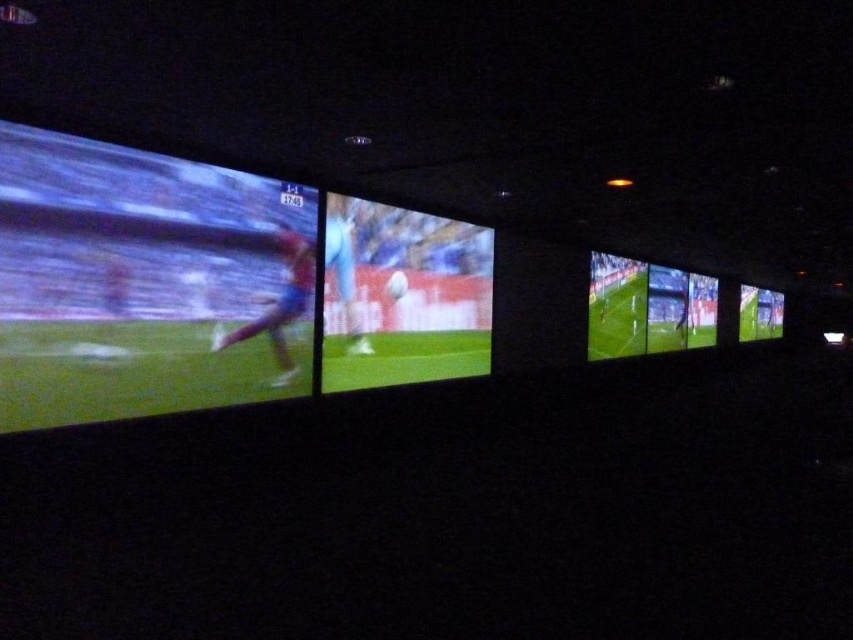
Between matte green screen at center and light blue jersey at center, which one appears on the right side from the viewer's perspective?

From the viewer's perspective, matte green screen at center appears more on the right side.

Does matte green screen at center have a greater height compared to light blue jersey at center?

Indeed, matte green screen at center has a greater height compared to light blue jersey at center.

You are a GUI agent. You are given a task and a screenshot of the screen. Output one action in this format:
    pyautogui.click(x=<x>, y=<y>)
    Task: Click on the matte green screen at center
    This screenshot has height=640, width=853.
    Given the screenshot: What is the action you would take?
    pyautogui.click(x=402, y=296)

Find the location of a particular element. This screenshot has width=853, height=640. matte red soccer player at center is located at coordinates (280, 300).

Between matte red soccer player at center and light blue jersey at center, which one has more height?

With more height is light blue jersey at center.

What do you see at coordinates (280, 300) in the screenshot?
I see `matte red soccer player at center` at bounding box center [280, 300].

Image resolution: width=853 pixels, height=640 pixels. In order to click on matte red soccer player at center in this screenshot , I will do `click(280, 300)`.

Is point (410, 371) positioned after point (286, 378)?

Yes, it is.

Does matte green screen at center have a greater width compared to matte red soccer player at center?

Correct, the width of matte green screen at center exceeds that of matte red soccer player at center.

Is point (386, 349) behind point (270, 336)?

Yes, it is.

Find the location of `matte green screen at center`. matte green screen at center is located at coordinates (402, 296).